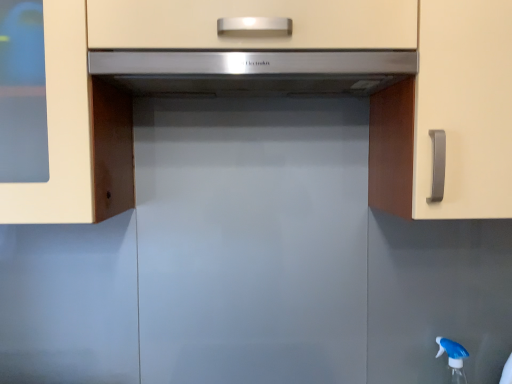
Question: From the image's perspective, is satin silver range hood at center below matte white cabinet at center?

Choices:
 (A) no
 (B) yes

Answer: (A)

Question: Considering the relative sizes of satin silver range hood at center and matte white cabinet at center in the image provided, is satin silver range hood at center shorter than matte white cabinet at center?

Choices:
 (A) no
 (B) yes

Answer: (B)

Question: Is there a large distance between satin silver range hood at center and matte white cabinet at center?

Choices:
 (A) no
 (B) yes

Answer: (A)

Question: Is satin silver range hood at center oriented away from matte white cabinet at center?

Choices:
 (A) yes
 (B) no

Answer: (A)

Question: Is satin silver range hood at center at the right side of matte white cabinet at center?

Choices:
 (A) yes
 (B) no

Answer: (B)

Question: Considering the positions of matte white cabinet at center and satin silver range hood at center in the image, is matte white cabinet at center taller or shorter than satin silver range hood at center?

Choices:
 (A) tall
 (B) short

Answer: (A)

Question: From a real-world perspective, relative to satin silver range hood at center, is matte white cabinet at center vertically above or below?

Choices:
 (A) above
 (B) below

Answer: (B)

Question: From the image's perspective, is matte white cabinet at center located above or below satin silver range hood at center?

Choices:
 (A) below
 (B) above

Answer: (A)

Question: Based on their positions, is matte white cabinet at center located to the left or right of satin silver range hood at center?

Choices:
 (A) right
 (B) left

Answer: (A)

Question: Based on their sizes in the image, would you say blue translucent spray bottle at lower right is bigger or smaller than matte white cabinet at center?

Choices:
 (A) big
 (B) small

Answer: (B)

Question: From a real-world perspective, relative to matte white cabinet at center, is blue translucent spray bottle at lower right vertically above or below?

Choices:
 (A) above
 (B) below

Answer: (B)

Question: Relative to matte white cabinet at center, is blue translucent spray bottle at lower right in front or behind?

Choices:
 (A) behind
 (B) front

Answer: (A)

Question: From the image's perspective, is blue translucent spray bottle at lower right above or below matte white cabinet at center?

Choices:
 (A) above
 (B) below

Answer: (B)

Question: Is satin silver range hood at center to the left or to the right of blue translucent spray bottle at lower right in the image?

Choices:
 (A) left
 (B) right

Answer: (A)

Question: Based on their sizes in the image, would you say satin silver range hood at center is bigger or smaller than blue translucent spray bottle at lower right?

Choices:
 (A) small
 (B) big

Answer: (B)